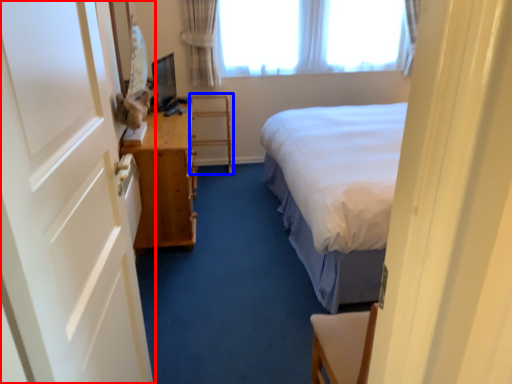
Question: Which of the following is the closest to the observer, door (highlighted by a red box) or furniture (highlighted by a blue box)?

Choices:
 (A) door
 (B) furniture

Answer: (A)